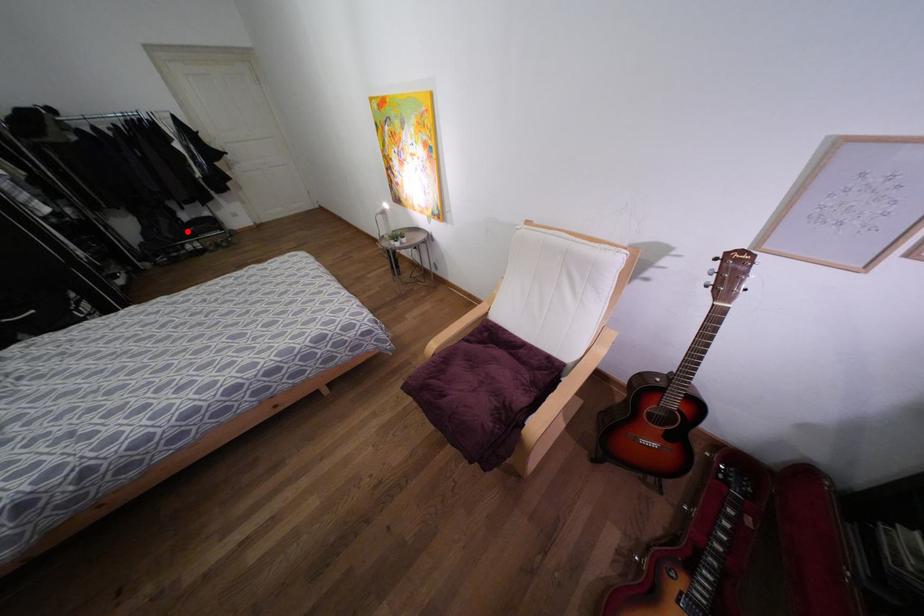
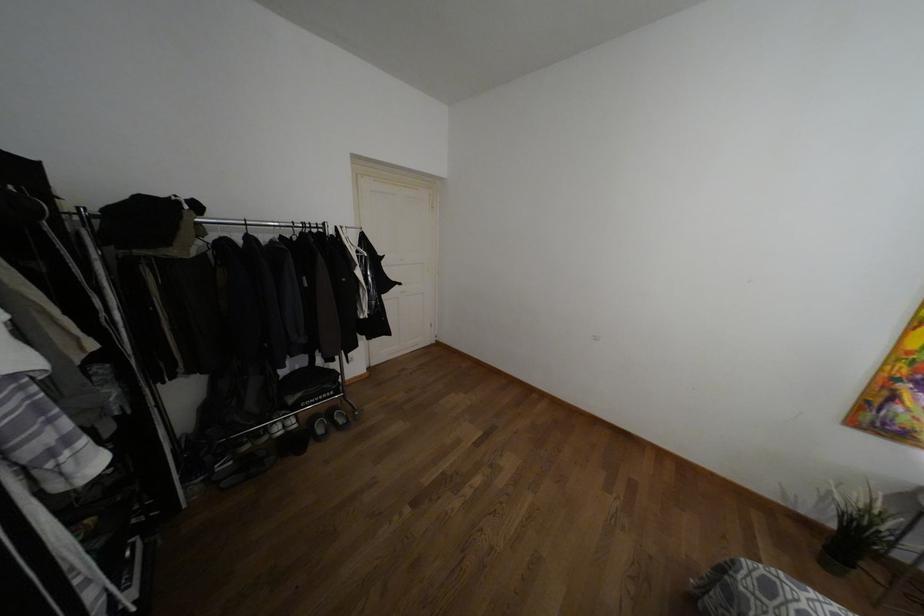
Question: I am providing you with two images of the same scene from different viewpoints. A red point is shown in image1. For the corresponding object point in image2, is it positioned nearer or farther from the camera?

Choices:
 (A) Nearer
 (B) Farther

Answer: (A)